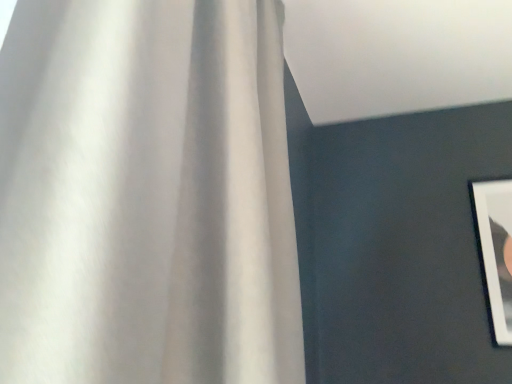
Image resolution: width=512 pixels, height=384 pixels. I want to click on white glossy picture frame at right, so click(496, 250).

What do you see at coordinates (496, 250) in the screenshot? Image resolution: width=512 pixels, height=384 pixels. I see `white glossy picture frame at right` at bounding box center [496, 250].

What is the approximate height of white matte curtain at upper left?

white matte curtain at upper left is 1.20 meters tall.

Image resolution: width=512 pixels, height=384 pixels. Describe the element at coordinates (146, 194) in the screenshot. I see `white matte curtain at upper left` at that location.

This screenshot has width=512, height=384. Find the location of `white matte curtain at upper left`. white matte curtain at upper left is located at coordinates (146, 194).

Find the location of a particular element. white glossy picture frame at right is located at coordinates coord(496,250).

Considering the positions of objects white glossy picture frame at right and white matte curtain at upper left in the image provided, who is more to the left, white glossy picture frame at right or white matte curtain at upper left?

Positioned to the left is white matte curtain at upper left.

Between white glossy picture frame at right and white matte curtain at upper left, which one is positioned in front?

white matte curtain at upper left is in front.

Is point (502, 325) farther from camera compared to point (157, 170)?

Yes, it is.

From the image's perspective, does white glossy picture frame at right appear lower than white matte curtain at upper left?

Yes, from the image's perspective, white glossy picture frame at right is below white matte curtain at upper left.

From a real-world perspective, which is physically below, white glossy picture frame at right or white matte curtain at upper left?

In real-world perspective, white glossy picture frame at right is lower.

Considering the relative sizes of white glossy picture frame at right and white matte curtain at upper left in the image provided, is white glossy picture frame at right wider than white matte curtain at upper left?

Incorrect, the width of white glossy picture frame at right does not surpass that of white matte curtain at upper left.

From their relative heights in the image, would you say white glossy picture frame at right is taller or shorter than white matte curtain at upper left?

In the image, white glossy picture frame at right appears to be shorter than white matte curtain at upper left.

Who is bigger, white glossy picture frame at right or white matte curtain at upper left?

white matte curtain at upper left.

Is white glossy picture frame at right spatially inside white matte curtain at upper left, or outside of it?

white glossy picture frame at right cannot be found inside white matte curtain at upper left.

Are white glossy picture frame at right and white matte curtain at upper left located far from each other?

Yes.

Is white glossy picture frame at right looking in the opposite direction of white matte curtain at upper left?

No, white glossy picture frame at right is not facing the opposite direction of white matte curtain at upper left.

Locate an element on the screen. This screenshot has width=512, height=384. picture frame that is on the right side of white matte curtain at upper left is located at coordinates pos(496,250).

Between white matte curtain at upper left and white glossy picture frame at right, which one appears on the right side from the viewer's perspective?

From the viewer's perspective, white glossy picture frame at right appears more on the right side.

Is white matte curtain at upper left in front of or behind white glossy picture frame at right in the image?

white matte curtain at upper left is in front of white glossy picture frame at right.

Is point (193, 123) positioned before point (510, 343)?

Yes.

From the image's perspective, is white matte curtain at upper left above white glossy picture frame at right?

Yes.

From a real-world perspective, is white matte curtain at upper left below white glossy picture frame at right?

Incorrect, from a real-world perspective, white matte curtain at upper left is higher than white glossy picture frame at right.

Considering the relative sizes of white matte curtain at upper left and white glossy picture frame at right in the image provided, is white matte curtain at upper left wider than white glossy picture frame at right?

Correct, the width of white matte curtain at upper left exceeds that of white glossy picture frame at right.

In terms of height, does white matte curtain at upper left look taller or shorter compared to white glossy picture frame at right?

Considering their sizes, white matte curtain at upper left has more height than white glossy picture frame at right.

Can you confirm if white matte curtain at upper left is smaller than white glossy picture frame at right?

No.

Can we say white matte curtain at upper left lies outside white glossy picture frame at right?

Indeed, white matte curtain at upper left is completely outside white glossy picture frame at right.

Is white matte curtain at upper left beside white glossy picture frame at right?

white matte curtain at upper left is not next to white glossy picture frame at right, and they're not touching.

Is white matte curtain at upper left turned away from white glossy picture frame at right?

white matte curtain at upper left is not turned away from white glossy picture frame at right.

How different are the orientations of white matte curtain at upper left and white glossy picture frame at right in degrees?

The facing directions of white matte curtain at upper left and white glossy picture frame at right are 91 degrees apart.

You are a GUI agent. You are given a task and a screenshot of the screen. Output one action in this format:
    pyautogui.click(x=<x>, y=<y>)
    Task: Click on the picture frame behind the white matte curtain at upper left
    
    Given the screenshot: What is the action you would take?
    pyautogui.click(x=496, y=250)

Find the location of `picture frame on the right side of white matte curtain at upper left`. picture frame on the right side of white matte curtain at upper left is located at coordinates (496, 250).

Where is `curtain that is on the left side of white glossy picture frame at right`? The height and width of the screenshot is (384, 512). curtain that is on the left side of white glossy picture frame at right is located at coordinates click(146, 194).